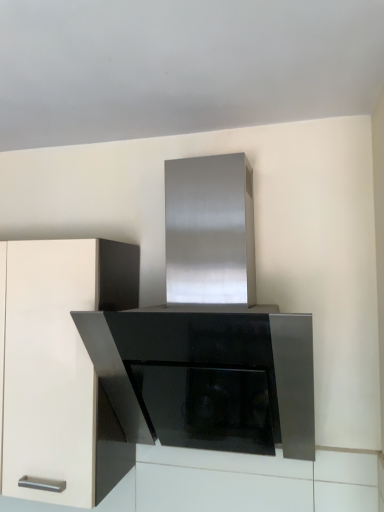
At what (x,y) coordinates should I click in order to perform the action: click on matte white cabinet at left. Please return your answer as a coordinate pair (x, y). Looking at the image, I should click on (62, 368).

The image size is (384, 512). What do you see at coordinates (62, 368) in the screenshot?
I see `matte white cabinet at left` at bounding box center [62, 368].

You are a GUI agent. You are given a task and a screenshot of the screen. Output one action in this format:
    pyautogui.click(x=<x>, y=<y>)
    Task: Click on the stainless steel range hood at center
    The width and height of the screenshot is (384, 512).
    Given the screenshot: What is the action you would take?
    pyautogui.click(x=208, y=332)

This screenshot has width=384, height=512. Describe the element at coordinates (208, 332) in the screenshot. I see `stainless steel range hood at center` at that location.

Where is `matte white cabinet at left`? matte white cabinet at left is located at coordinates coord(62,368).

Can you confirm if stainless steel range hood at center is positioned to the right of matte white cabinet at left?

Correct, you'll find stainless steel range hood at center to the right of matte white cabinet at left.

Between stainless steel range hood at center and matte white cabinet at left, which one is positioned behind?

matte white cabinet at left is further away from the camera.

Consider the image. Which is farther, (112,314) or (6,284)?

The point (6,284) is behind.

From the image's perspective, is stainless steel range hood at center on matte white cabinet at left?

Yes.

From a real-world perspective, who is located lower, stainless steel range hood at center or matte white cabinet at left?

matte white cabinet at left is physically lower.

Is stainless steel range hood at center wider than matte white cabinet at left?

Yes.

Can you confirm if stainless steel range hood at center is taller than matte white cabinet at left?

Correct, stainless steel range hood at center is much taller as matte white cabinet at left.

Does stainless steel range hood at center have a smaller size compared to matte white cabinet at left?

No, stainless steel range hood at center is not smaller than matte white cabinet at left.

Is stainless steel range hood at center outside of matte white cabinet at left?

stainless steel range hood at center lies outside matte white cabinet at left's area.

Looking at this image, can you see stainless steel range hood at center touching matte white cabinet at left?

No, stainless steel range hood at center is not with matte white cabinet at left.

Is stainless steel range hood at center oriented towards matte white cabinet at left?

No, stainless steel range hood at center is not turned towards matte white cabinet at left.

From the picture: Measure the distance between stainless steel range hood at center and matte white cabinet at left.

stainless steel range hood at center and matte white cabinet at left are 31.94 centimeters apart.

You are a GUI agent. You are given a task and a screenshot of the screen. Output one action in this format:
    pyautogui.click(x=<x>, y=<y>)
    Task: Click on the cabinetry on the left of stainless steel range hood at center
    The width and height of the screenshot is (384, 512).
    Given the screenshot: What is the action you would take?
    pyautogui.click(x=62, y=368)

Is matte white cabinet at left at the right side of stainless steel range hood at center?

No, matte white cabinet at left is not to the right of stainless steel range hood at center.

Considering their positions, is matte white cabinet at left located in front of or behind stainless steel range hood at center?

Clearly, matte white cabinet at left is behind stainless steel range hood at center.

Which is closer to the camera, (7,401) or (230,429)?

Positioned in front is point (7,401).

In the scene shown: From the image's perspective, is matte white cabinet at left positioned above or below stainless steel range hood at center?

Based on their image positions, matte white cabinet at left is located beneath stainless steel range hood at center.

From a real-world perspective, which object stands above the other?

From a 3D spatial view, stainless steel range hood at center is above.

Considering the sizes of objects matte white cabinet at left and stainless steel range hood at center in the image provided, who is thinner, matte white cabinet at left or stainless steel range hood at center?

matte white cabinet at left is thinner.

Can you confirm if matte white cabinet at left is shorter than stainless steel range hood at center?

Indeed, matte white cabinet at left has a lesser height compared to stainless steel range hood at center.

Considering the sizes of matte white cabinet at left and stainless steel range hood at center in the image, is matte white cabinet at left bigger or smaller than stainless steel range hood at center?

In the image, matte white cabinet at left appears to be smaller than stainless steel range hood at center.

Would you say matte white cabinet at left contains stainless steel range hood at center?

No, stainless steel range hood at center is located outside of matte white cabinet at left.

Is matte white cabinet at left in contact with stainless steel range hood at center?

No, matte white cabinet at left is not touching stainless steel range hood at center.

Is matte white cabinet at left looking in the opposite direction of stainless steel range hood at center?

No.

In the scene shown: How different are the orientations of matte white cabinet at left and stainless steel range hood at center in degrees?

1.11 degrees separate the facing orientations of matte white cabinet at left and stainless steel range hood at center.

The width and height of the screenshot is (384, 512). Identify the location of appliance to the right of matte white cabinet at left. (208, 332).

This screenshot has width=384, height=512. I want to click on appliance that is on the right side of matte white cabinet at left, so click(208, 332).

This screenshot has width=384, height=512. What are the coordinates of `cabinetry below the stainless steel range hood at center (from a real-world perspective)` in the screenshot? It's located at (62, 368).